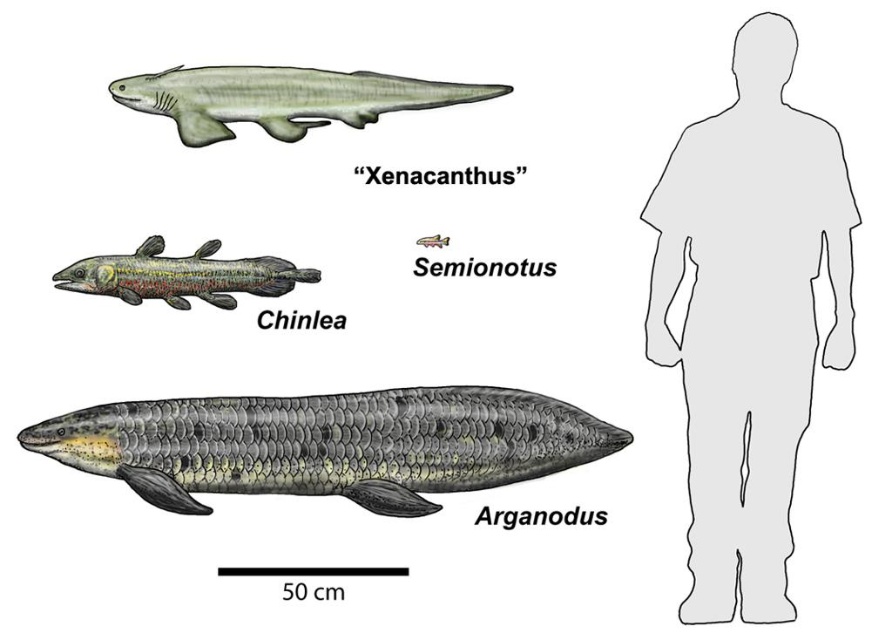
Question: Can you confirm if silhouette figure at center is wider than greenish-gray scaly xenacanthus at upper center?

Choices:
 (A) yes
 (B) no

Answer: (B)

Question: Is shiny metallic fish at center positioned behind shiny greenish-blue fish at center?

Choices:
 (A) no
 (B) yes

Answer: (A)

Question: Which of these objects is positioned farthest from the shiny silver fish at upper center?

Choices:
 (A) greenish-gray scaly xenacanthus at upper center
 (B) shiny metallic fish at center
 (C) silhouette figure at center

Answer: (C)

Question: Estimate the real-world distances between objects in this image. Which object is closer to the silhouette figure at center?

Choices:
 (A) shiny greenish-blue fish at center
 (B) greenish-gray scaly xenacanthus at upper center

Answer: (B)

Question: Can you confirm if silhouette figure at center is smaller than shiny metallic fish at center?

Choices:
 (A) yes
 (B) no

Answer: (B)

Question: Which of the following is the farthest from the observer?

Choices:
 (A) (745, 164)
 (B) (271, 108)
 (C) (442, 243)
 (D) (122, 266)

Answer: (C)